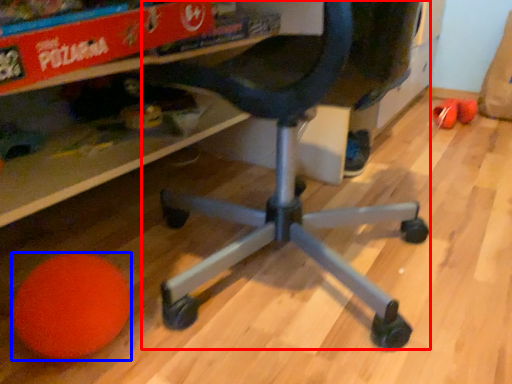
Question: Which object appears closest to the camera in this image, computer chair (highlighted by a red box) or ball (highlighted by a blue box)?

Choices:
 (A) computer chair
 (B) ball

Answer: (A)